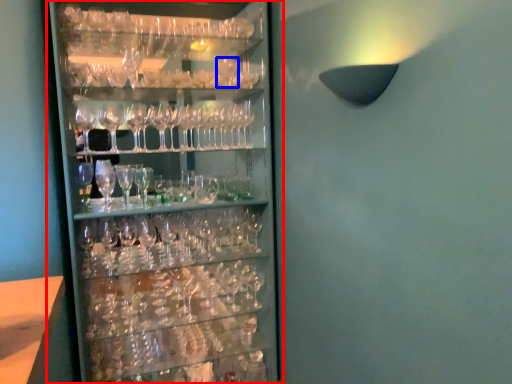
Question: Which object is further to the camera taking this photo, shelf (highlighted by a red box) or wine glass (highlighted by a blue box)?

Choices:
 (A) shelf
 (B) wine glass

Answer: (B)